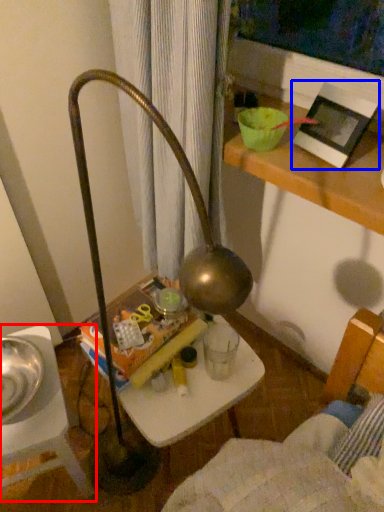
Question: Which point is closer to the camera, furniture (highlighted by a red box) or picture frame (highlighted by a blue box)?

Choices:
 (A) furniture
 (B) picture frame

Answer: (B)